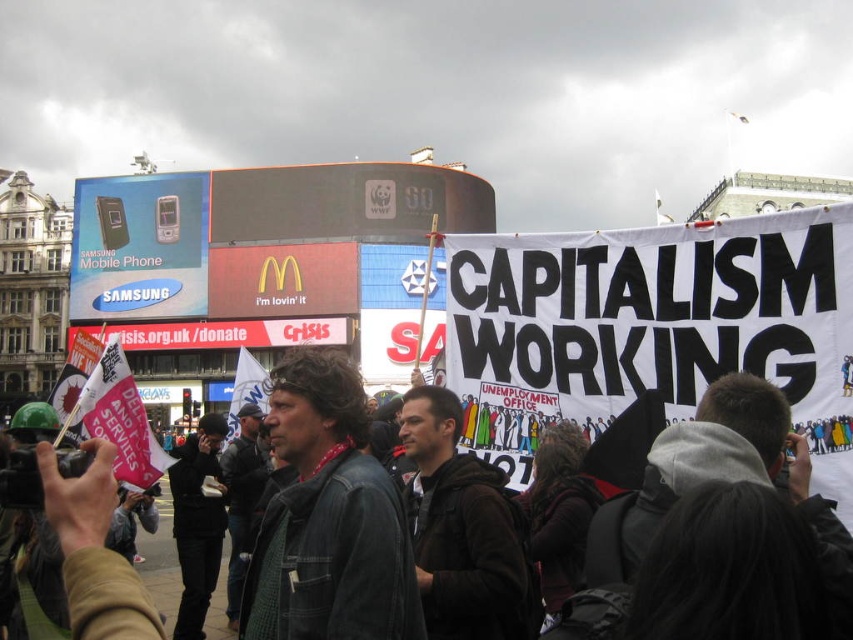
Question: Which point is farther to the camera?

Choices:
 (A) denim jacket at center
 (B) dark brown leather jacket at center

Answer: (A)

Question: Does denim jacket at center have a smaller size compared to metallic glossy mobile phone at upper left?

Choices:
 (A) yes
 (B) no

Answer: (B)

Question: Where is dark brown leather jacket at center located in relation to metallic glossy mobile phone at upper left in the image?

Choices:
 (A) above
 (B) below

Answer: (B)

Question: Which point is farther to the camera?

Choices:
 (A) metallic glossy mobile phone at upper left
 (B) dark brown leather jacket at center

Answer: (A)

Question: Based on their relative distances, which object is nearer to the metallic glossy mobile phone at upper left?

Choices:
 (A) dark brown leather jacket at center
 (B) denim jacket at center

Answer: (A)

Question: Is dark brown leather jacket at center thinner than denim jacket at center?

Choices:
 (A) no
 (B) yes

Answer: (A)